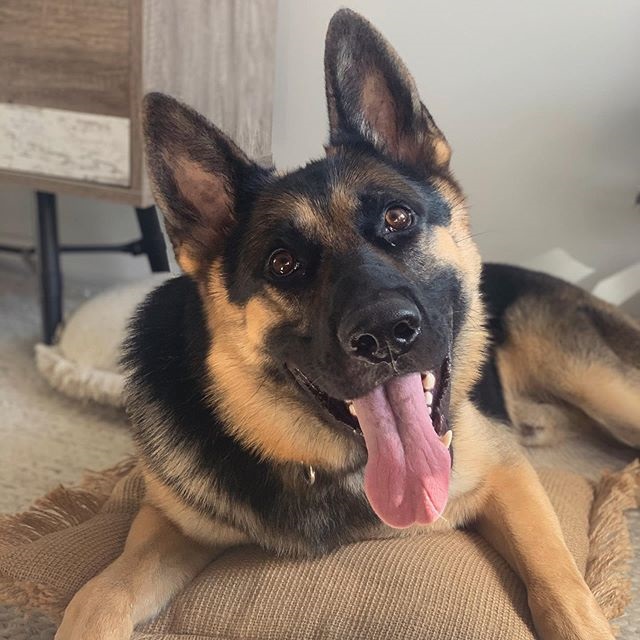
Locate an element on the screen. Image resolution: width=640 pixels, height=640 pixels. left front leg is located at coordinates (532, 525).